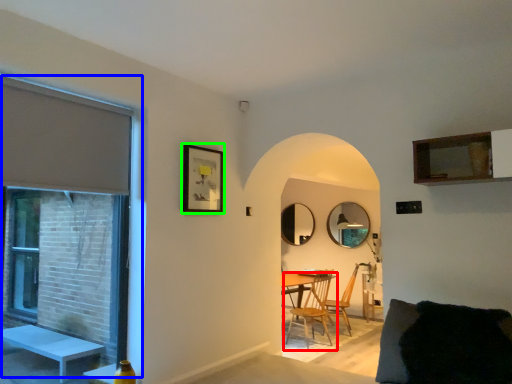
Question: Estimate the real-world distances between objects in this image. Which object is closer to chair (highlighted by a red box), window (highlighted by a blue box) or picture frame (highlighted by a green box)?

Choices:
 (A) window
 (B) picture frame

Answer: (A)